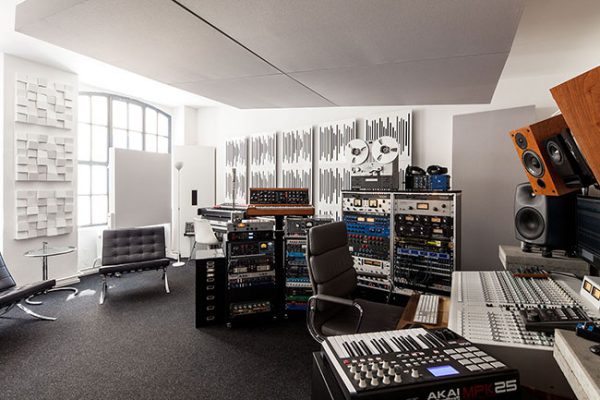
Identify the location of off-white ceiling. (312, 45).